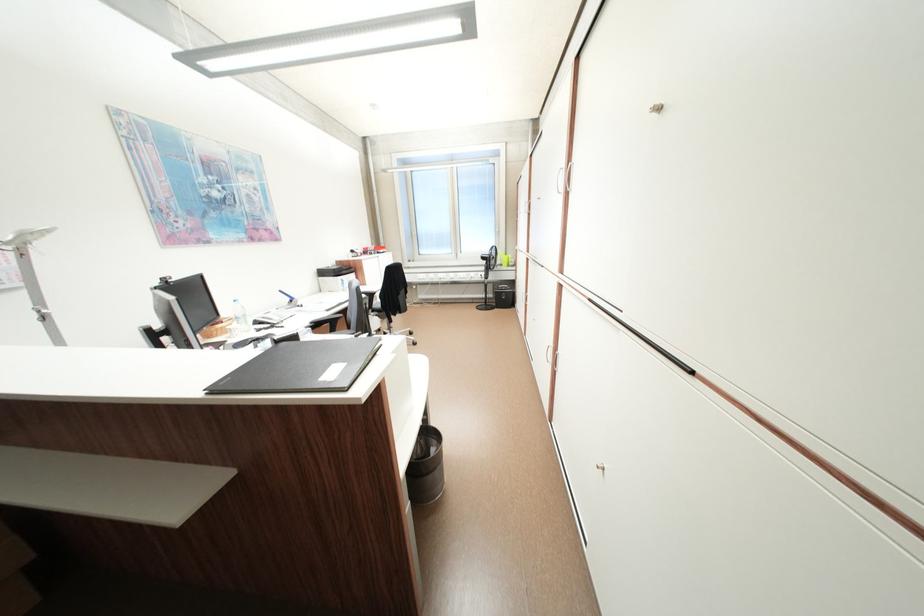
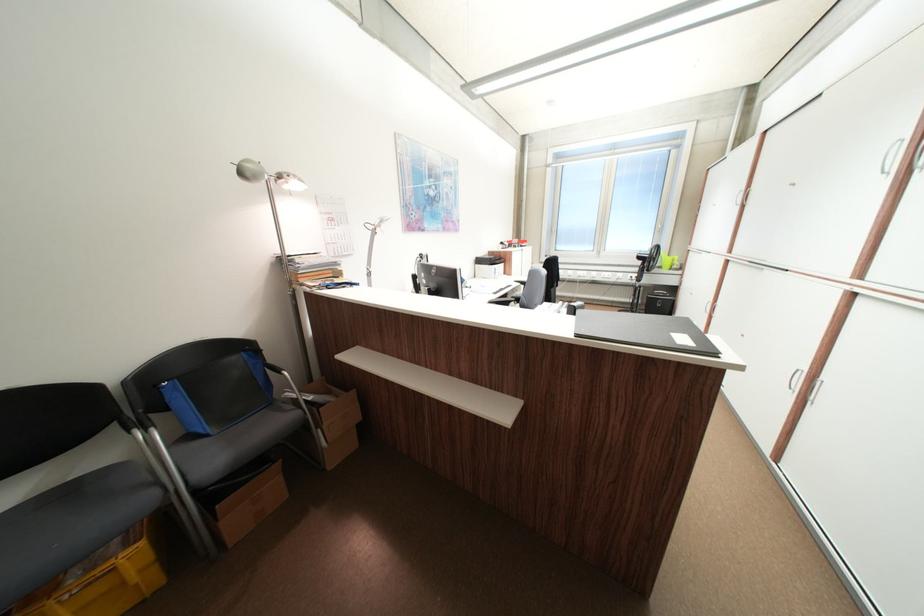
What movement of the cameraman would produce the second image?

The cameraman walked toward left, backward.